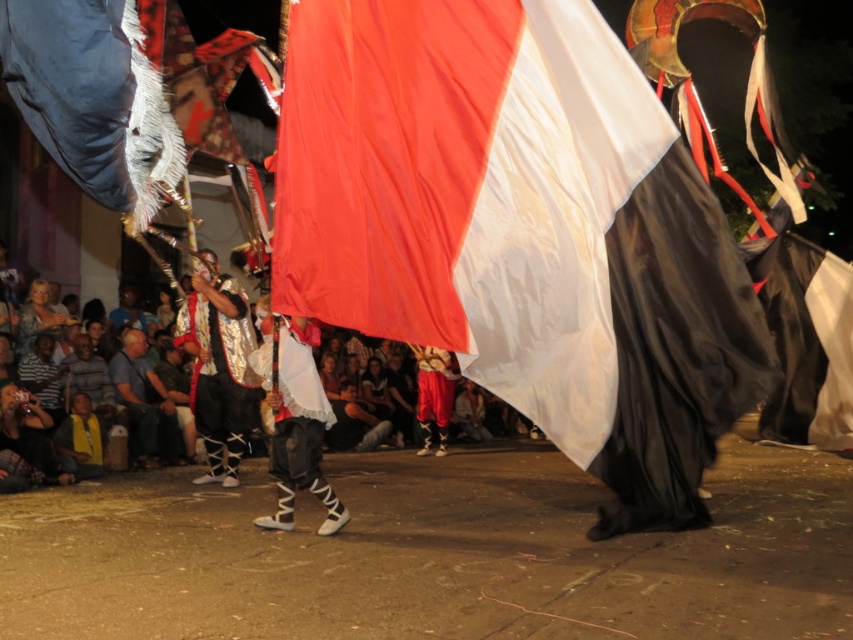
Does white matte pants at center come behind golden textured sweater at lower left?

No.

Consider the image. Who is more forward, (311, 403) or (16, 339)?

Positioned in front is point (311, 403).

Locate an element on the screen. The width and height of the screenshot is (853, 640). white matte pants at center is located at coordinates (294, 417).

Is shiny metallic robe at center closer to the viewer compared to golden textured sweater at lower left?

Yes, shiny metallic robe at center is in front of golden textured sweater at lower left.

Who is shorter, shiny metallic robe at center or golden textured sweater at lower left?

Standing shorter between the two is golden textured sweater at lower left.

This screenshot has width=853, height=640. What do you see at coordinates (219, 369) in the screenshot?
I see `shiny metallic robe at center` at bounding box center [219, 369].

Locate an element on the screen. shiny metallic robe at center is located at coordinates (219, 369).

Can you confirm if silky red-white flag at center is positioned below shiny metallic robe at center?

No, silky red-white flag at center is not below shiny metallic robe at center.

How much distance is there between silky red-white flag at center and shiny metallic robe at center?

silky red-white flag at center is 4.16 meters from shiny metallic robe at center.

Between point (666, 236) and point (212, 262), which one is positioned behind?

Positioned behind is point (212, 262).

Locate an element on the screen. silky red-white flag at center is located at coordinates coord(520,228).